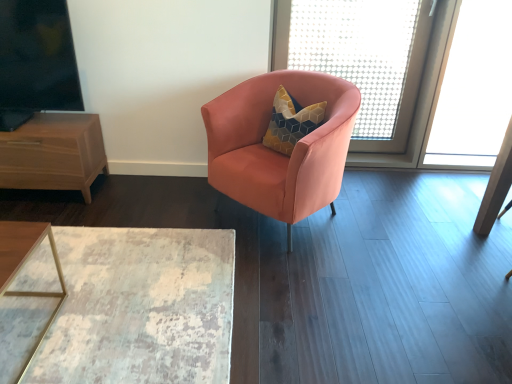
Where is `vacant space that's between satin peach armchair at center and distressed wood table at lower left`? This screenshot has height=384, width=512. vacant space that's between satin peach armchair at center and distressed wood table at lower left is located at coordinates (203, 226).